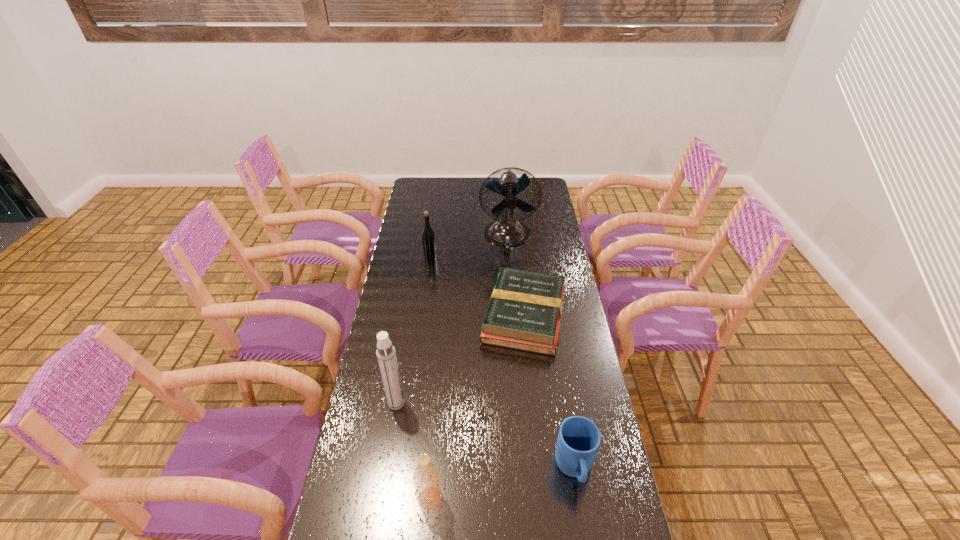
The width and height of the screenshot is (960, 540). In order to click on mug situated at the right edge in this screenshot , I will do `click(579, 438)`.

Identify the location of hardback book that is positioned at the right edge. (524, 313).

In order to click on vacant space at the far edge in this screenshot , I will do 473,195.

You are a GUI agent. You are given a task and a screenshot of the screen. Output one action in this format:
    pyautogui.click(x=<x>, y=<y>)
    Task: Click on the vacant space at the left edge
    The image size is (960, 540).
    Given the screenshot: What is the action you would take?
    pyautogui.click(x=404, y=255)

I want to click on vacant space at the right edge, so click(x=568, y=501).

Locate an element on the screen. The width and height of the screenshot is (960, 540). free point between the second shortest object and the second tallest object is located at coordinates (486, 436).

Where is `empty location between the fifth tallest object and the fourth nearest object`? This screenshot has width=960, height=540. empty location between the fifth tallest object and the fourth nearest object is located at coordinates (549, 393).

Locate an element on the screen. Image resolution: width=960 pixels, height=540 pixels. free space that is in between the mug and the right beer bottle is located at coordinates (502, 484).

Identify the location of free space between the right beer bottle and the mug. (502, 484).

Where is `free space that is in between the fifth nearest object and the shortest object`? free space that is in between the fifth nearest object and the shortest object is located at coordinates (477, 286).